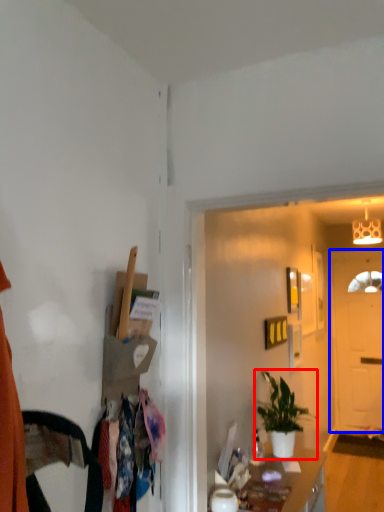
Question: Which of the following is the farthest to the observer, houseplant (highlighted by a red box) or door (highlighted by a blue box)?

Choices:
 (A) houseplant
 (B) door

Answer: (B)